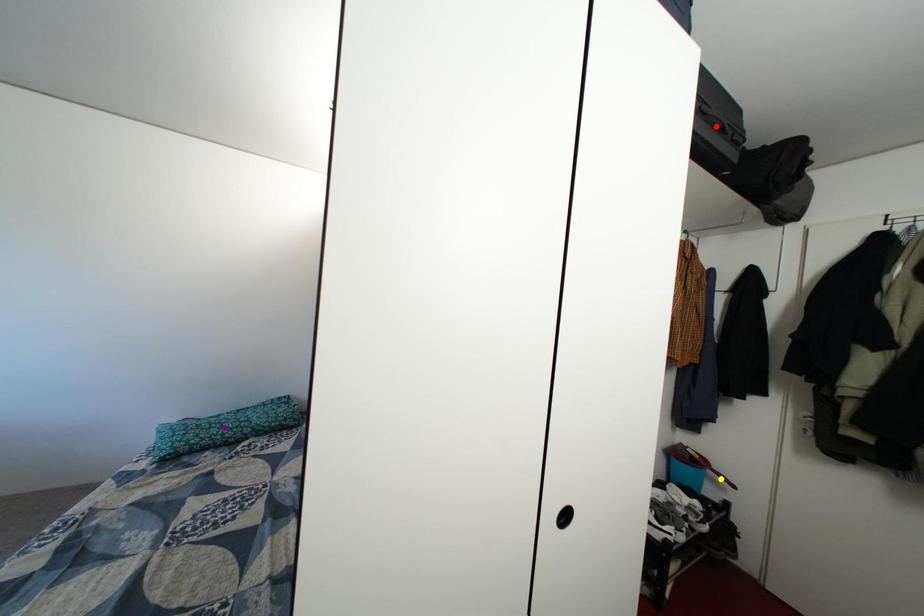
Order these from nearest to farthest:
A) purple point
B) red point
C) yellow point

red point → yellow point → purple point